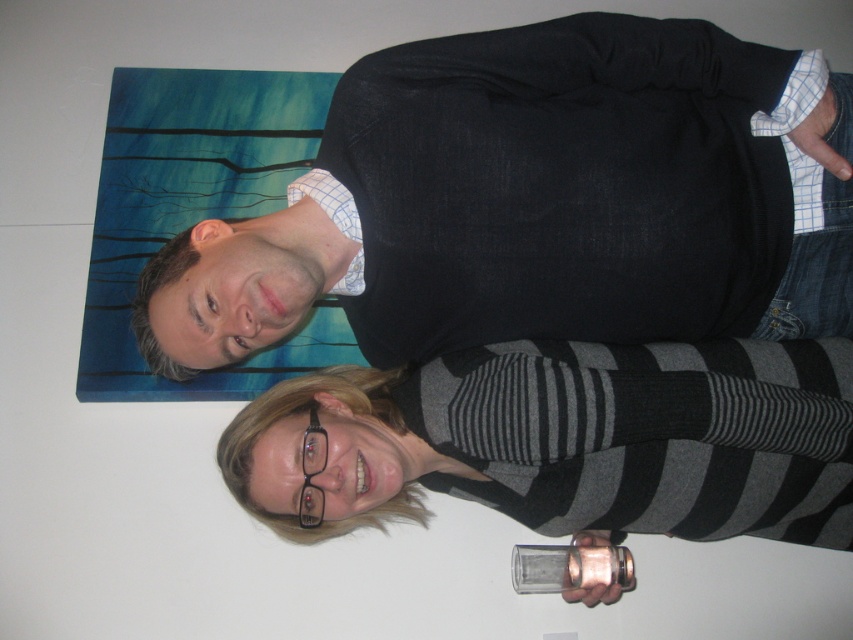
Based on the scene description, which object is located at the coordinates point (538, 202)?

The black cotton sweater at upper center is located at point (538, 202).

You are an interior designer observing the scene. You need to place a decorative item between the black cotton sweater at upper center and the clear glass at lower center. Which object should the item be closer to, based on their positions?

Answer: The black cotton sweater at upper center is to the left of the clear glass at lower center. Therefore, placing the decorative item closer to the left side would position it between them, aligning with the black cotton sweater at upper center.